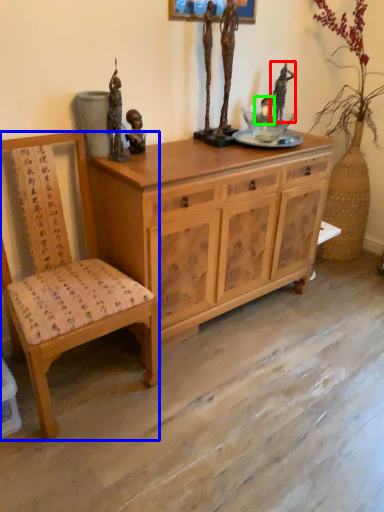
Question: Which object is the closest to the person (highlighted by a red box)? Choose among these: chair (highlighted by a blue box) or person (highlighted by a green box).

Choices:
 (A) chair
 (B) person

Answer: (B)